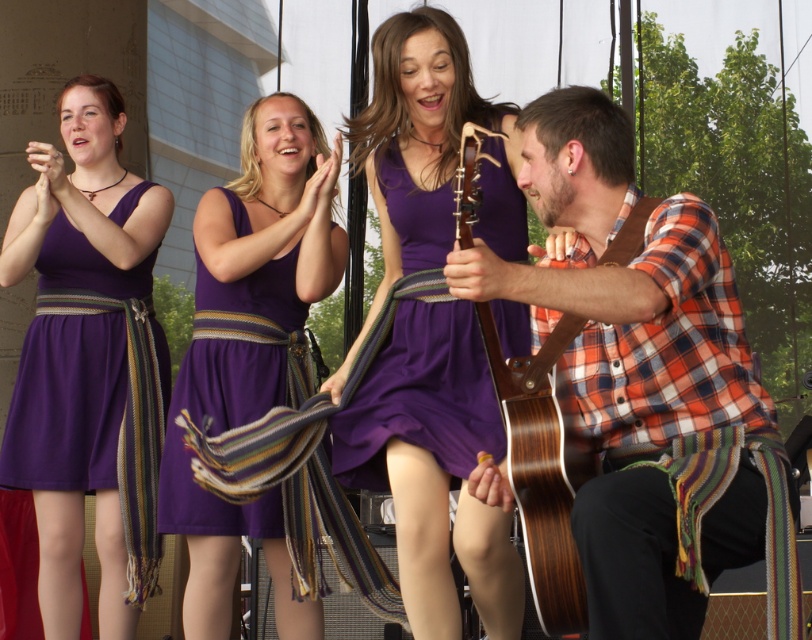
Is purple satin dress at center shorter than wooden acoustic guitar at right?

Yes, purple satin dress at center is shorter than wooden acoustic guitar at right.

Between purple satin dress at center and wooden acoustic guitar at right, which one is positioned lower?

Positioned lower is wooden acoustic guitar at right.

Measure the distance between point (376, 428) and camera.

The distance of point (376, 428) from camera is 19.05 feet.

What are the coordinates of `purple satin dress at center` in the screenshot? It's located at (420, 396).

Which is above, purple matte dress at left or wooden acoustic guitar at right?

wooden acoustic guitar at right is higher up.

Who is positioned more to the right, purple matte dress at left or wooden acoustic guitar at right?

Positioned to the right is wooden acoustic guitar at right.

Is point (91, 225) positioned before point (572, 547)?

No, it is not.

The height and width of the screenshot is (640, 812). What are the coordinates of `purple matte dress at left` in the screenshot? It's located at (89, 362).

Is point (266, 298) behind point (564, 554)?

Yes, it is.

Is the position of purple matte dress at center less distant than that of wooden acoustic guitar at right?

No, it is behind wooden acoustic guitar at right.

Identify the location of purple matte dress at center. The width and height of the screenshot is (812, 640). (273, 220).

At what (x,y) coordinates should I click in order to perform the action: click on purple matte dress at center. Please return your answer as a coordinate pair (x, y). Image resolution: width=812 pixels, height=640 pixels. Looking at the image, I should click on (273, 220).